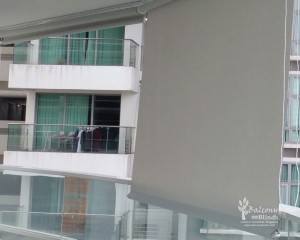
Locate an element on the screen. The width and height of the screenshot is (300, 240). chair is located at coordinates (50, 140).